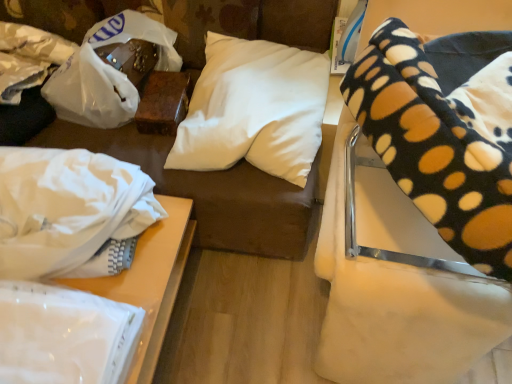
Question: Does white fabric at lower left have a greater height compared to black polka dot blanket at upper right?

Choices:
 (A) no
 (B) yes

Answer: (A)

Question: Considering the relative positions of white fabric at lower left and black polka dot blanket at upper right in the image provided, is white fabric at lower left to the left of black polka dot blanket at upper right from the viewer's perspective?

Choices:
 (A) yes
 (B) no

Answer: (A)

Question: Is the position of white fabric at lower left more distant than that of black polka dot blanket at upper right?

Choices:
 (A) yes
 (B) no

Answer: (A)

Question: From a real-world perspective, is white fabric at lower left positioned over black polka dot blanket at upper right based on gravity?

Choices:
 (A) yes
 (B) no

Answer: (B)

Question: Considering the relative sizes of white fabric at lower left and black polka dot blanket at upper right in the image provided, is white fabric at lower left thinner than black polka dot blanket at upper right?

Choices:
 (A) yes
 (B) no

Answer: (A)

Question: Choose the correct answer: Is white fabric at lower left inside white soft pillow at upper center or outside it?

Choices:
 (A) outside
 (B) inside

Answer: (A)

Question: Considering the positions of white fabric at lower left and white soft pillow at upper center in the image, is white fabric at lower left bigger or smaller than white soft pillow at upper center?

Choices:
 (A) small
 (B) big

Answer: (B)

Question: Considering the positions of white fabric at lower left and white soft pillow at upper center in the image, is white fabric at lower left wider or thinner than white soft pillow at upper center?

Choices:
 (A) thin
 (B) wide

Answer: (B)

Question: In the image, is white fabric at lower left on the left side or the right side of white soft pillow at upper center?

Choices:
 (A) left
 (B) right

Answer: (A)

Question: In the image, is white fabric at lower left positioned in front of or behind black polka dot blanket at upper right?

Choices:
 (A) behind
 (B) front

Answer: (A)

Question: Looking at the image, does white fabric at lower left seem bigger or smaller compared to black polka dot blanket at upper right?

Choices:
 (A) small
 (B) big

Answer: (A)

Question: In terms of width, does white fabric at lower left look wider or thinner when compared to black polka dot blanket at upper right?

Choices:
 (A) wide
 (B) thin

Answer: (B)

Question: From a real-world perspective, is white fabric at lower left positioned above or below black polka dot blanket at upper right?

Choices:
 (A) below
 (B) above

Answer: (A)

Question: Is black polka dot blanket at upper right to the left or to the right of white soft pillow at upper center in the image?

Choices:
 (A) right
 (B) left

Answer: (A)

Question: Is black polka dot blanket at upper right in front of or behind white soft pillow at upper center in the image?

Choices:
 (A) front
 (B) behind

Answer: (A)